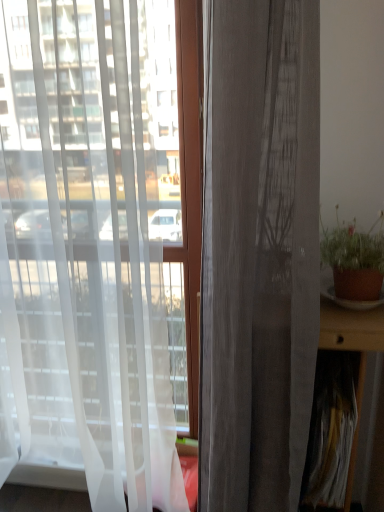
Question: From a real-world perspective, is brown clay pot at right on brown wooden table at right?

Choices:
 (A) no
 (B) yes

Answer: (B)

Question: Does brown clay pot at right have a larger size compared to brown wooden table at right?

Choices:
 (A) yes
 (B) no

Answer: (B)

Question: Can you confirm if brown clay pot at right is thinner than brown wooden table at right?

Choices:
 (A) yes
 (B) no

Answer: (A)

Question: Considering the relative sizes of brown clay pot at right and brown wooden table at right in the image provided, is brown clay pot at right smaller than brown wooden table at right?

Choices:
 (A) yes
 (B) no

Answer: (A)

Question: Does brown clay pot at right lie in front of brown wooden table at right?

Choices:
 (A) yes
 (B) no

Answer: (B)

Question: Can you confirm if brown clay pot at right is wider than brown wooden table at right?

Choices:
 (A) no
 (B) yes

Answer: (A)

Question: From a real-world perspective, is brown clay pot at right physically below matte gray curtain at center, which is the 2th curtain in left-to-right order?

Choices:
 (A) no
 (B) yes

Answer: (A)

Question: Is brown clay pot at right not inside matte gray curtain at center, the 1th curtain in the right-to-left sequence?

Choices:
 (A) no
 (B) yes

Answer: (B)

Question: Considering the relative sizes of brown clay pot at right and matte gray curtain at center, which is the 2th curtain in left-to-right order, in the image provided, is brown clay pot at right bigger than matte gray curtain at center, which is the 2th curtain in left-to-right order,?

Choices:
 (A) yes
 (B) no

Answer: (B)

Question: Is brown clay pot at right oriented towards matte gray curtain at center, which is the 2th curtain in left-to-right order?

Choices:
 (A) no
 (B) yes

Answer: (A)

Question: Does brown clay pot at right have a greater height compared to matte gray curtain at center, which is the 2th curtain in left-to-right order?

Choices:
 (A) no
 (B) yes

Answer: (A)

Question: Can you see brown clay pot at right touching matte gray curtain at center, which is the 2th curtain in left-to-right order?

Choices:
 (A) no
 (B) yes

Answer: (A)

Question: Does white sheer curtain at left, arranged as the 1th curtain when viewed from the left, have a smaller size compared to brown wooden table at right?

Choices:
 (A) no
 (B) yes

Answer: (A)